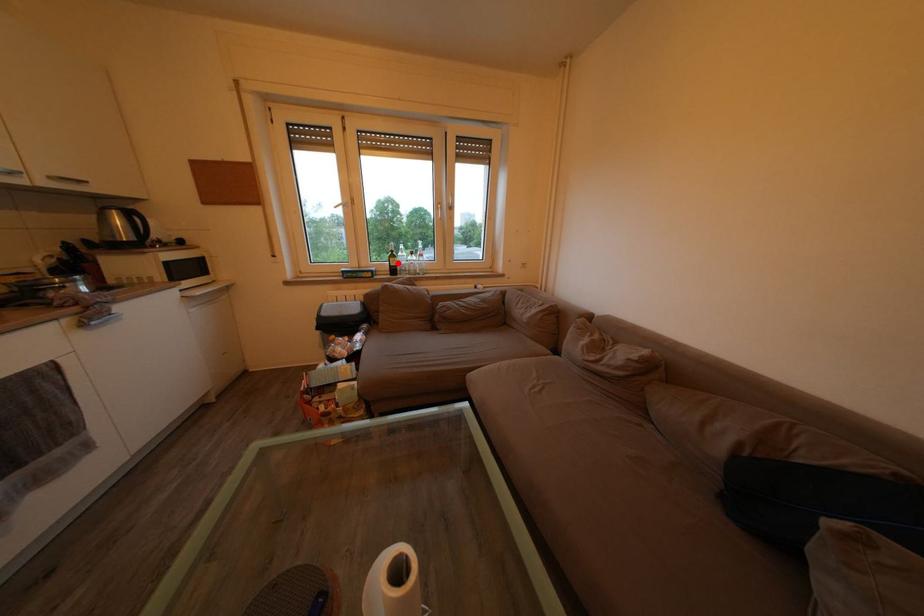
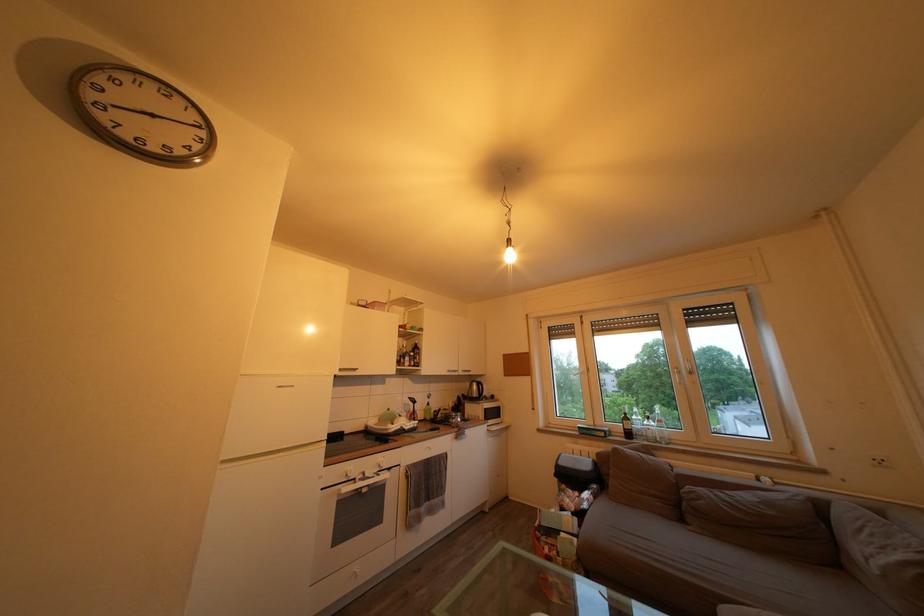
Where in the second image is the point corresponding to the highlighted location from the first image?

(630, 426)